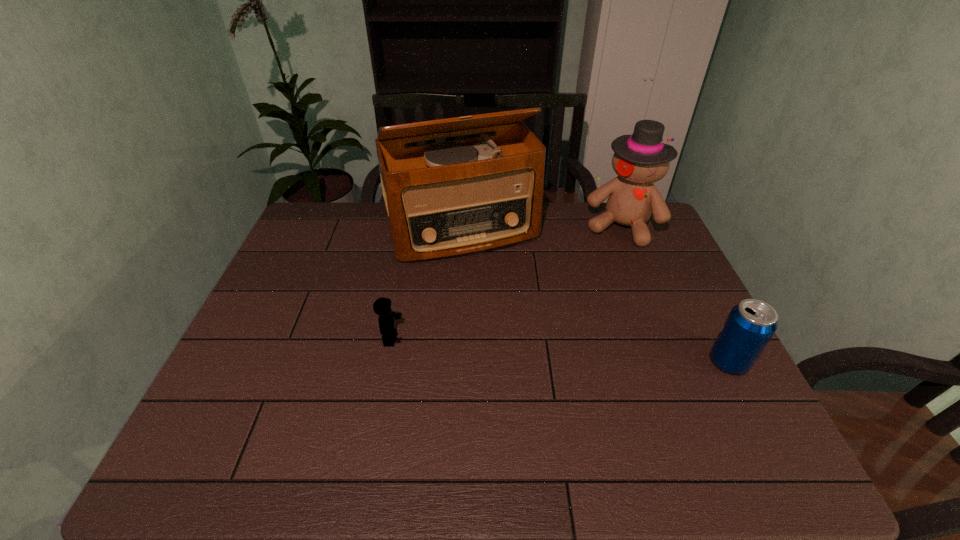
At what (x,y) coordinates should I click in order to perform the action: click on vacant region located on the front panel of the tallest object. Please return your answer as a coordinate pair (x, y). Looking at the image, I should click on [x=524, y=347].

The height and width of the screenshot is (540, 960). I want to click on vacant region located on the front panel of the tallest object, so click(x=533, y=365).

The image size is (960, 540). I want to click on rag_doll at the far edge, so click(x=640, y=159).

Identify the location of radio receiver that is positioned at the far edge. The height and width of the screenshot is (540, 960). (448, 199).

The height and width of the screenshot is (540, 960). Find the location of `pop soda located in the right edge section of the desktop`. pop soda located in the right edge section of the desktop is located at coordinates (750, 325).

The width and height of the screenshot is (960, 540). Identify the location of rag_doll located at the right edge. (640, 159).

Locate an element on the screen. The height and width of the screenshot is (540, 960). object present at the far right corner is located at coordinates (640, 159).

The width and height of the screenshot is (960, 540). Find the location of `blank area at the far edge`. blank area at the far edge is located at coordinates (358, 219).

Where is `vacant region at the near edge of the desktop`? vacant region at the near edge of the desktop is located at coordinates (493, 397).

The height and width of the screenshot is (540, 960). I want to click on free spot at the left edge of the desktop, so click(x=274, y=309).